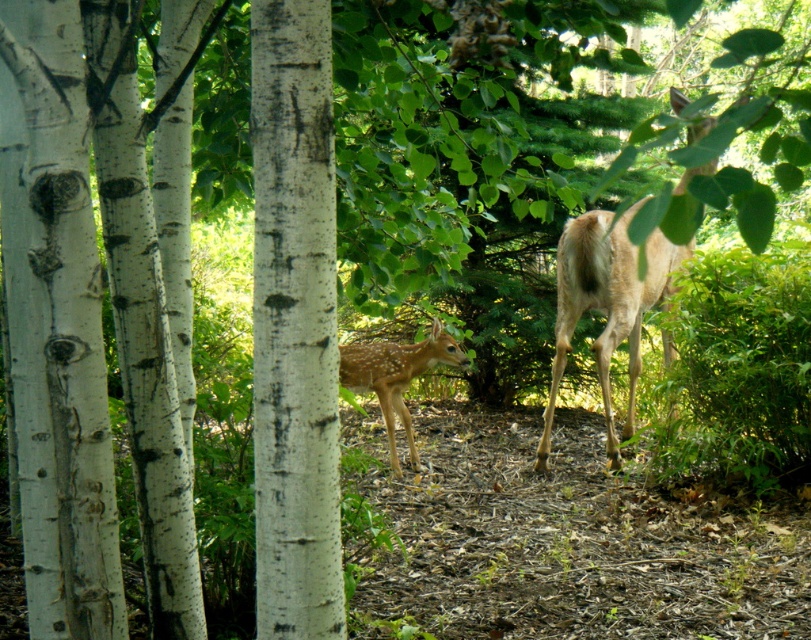
You are a wildlife photographer aiming to capture both the light brown fur at right and the fawn fur at center in a single shot. Based on their positions, which deer should you focus on first to ensure both are in clear view?

The light brown fur at right is closer to the viewer than the fawn fur at center. By focusing on the closer deer first, you can ensure depth of field captures both in clear view.

You are standing in the forest and want to reach the point marked as point (x=603, y=262). If you can walk 25 feet in 1 minute, how long will it take you to reach that point?

The distance between you and point (x=603, y=262) is 23.14 feet. Since you can walk 25 feet in 1 minute, it will take approximately 0.925 minutes, which is about 55.5 seconds, to reach the point.